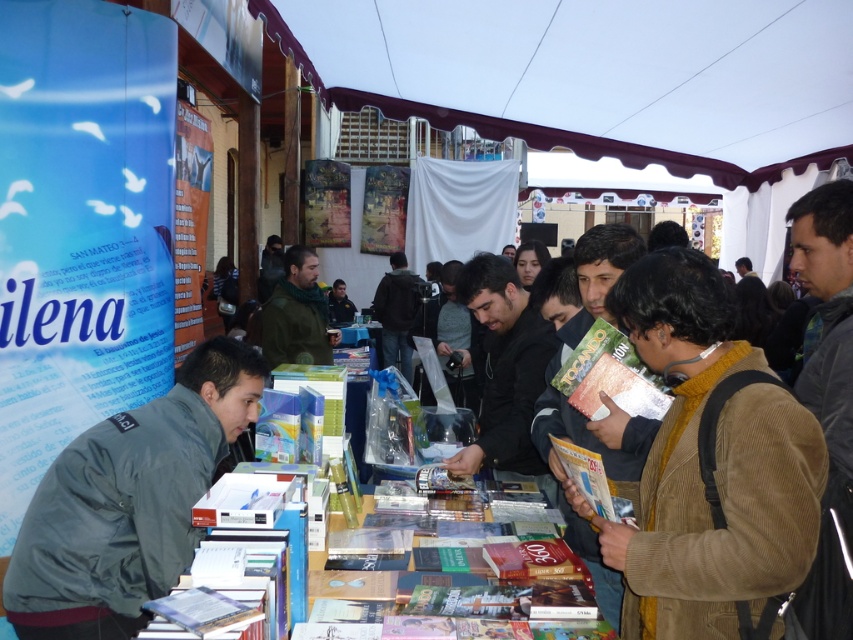
Is point (109, 596) positioned in front of point (592, 548)?

Yes, point (109, 596) is closer to viewer.

From the picture: Does dark gray jacket at lower left have a greater width compared to brown corduroy jacket at center?

Indeed, dark gray jacket at lower left has a greater width compared to brown corduroy jacket at center.

Which is behind, point (45, 582) or point (624, 252)?

Positioned behind is point (624, 252).

The width and height of the screenshot is (853, 640). In order to click on dark gray jacket at lower left in this screenshot , I will do `click(128, 502)`.

Can you confirm if dark gray jacket at lower left is positioned below green corduroy jacket at center?

Correct, dark gray jacket at lower left is located below green corduroy jacket at center.

Is point (173, 500) positioned behind point (299, 298)?

No.

Which is in front, point (39, 604) or point (318, 332)?

Point (39, 604) is more forward.

Image resolution: width=853 pixels, height=640 pixels. What are the coordinates of `dark gray jacket at lower left` in the screenshot? It's located at (128, 502).

Who is more forward, (503, 355) or (303, 252)?

Positioned in front is point (503, 355).

Is point (486, 440) closer to viewer compared to point (323, 332)?

Yes, it is in front of point (323, 332).

Does point (486, 294) come closer to viewer compared to point (317, 316)?

Yes, point (486, 294) is in front of point (317, 316).

I want to click on black matte jacket at center, so click(503, 368).